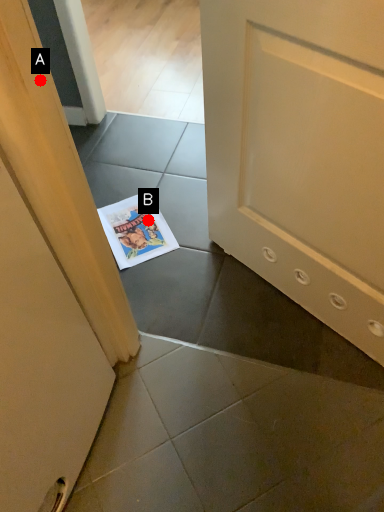
Question: Two points are circled on the image, labeled by A and B beside each circle. Which of the following is the farthest from the observer?

Choices:
 (A) A is further
 (B) B is further

Answer: (B)